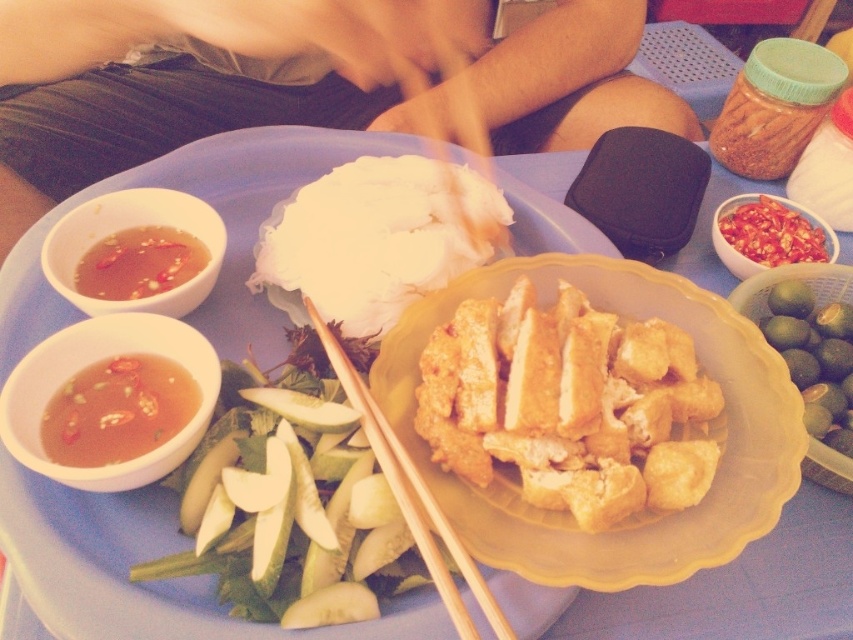
Does skinny jeans at upper left lie behind golden crispy chicken at center?

Yes, skinny jeans at upper left is further from the viewer.

Identify the location of skinny jeans at upper left. (143, 100).

The width and height of the screenshot is (853, 640). What do you see at coordinates (143, 100) in the screenshot?
I see `skinny jeans at upper left` at bounding box center [143, 100].

You are a GUI agent. You are given a task and a screenshot of the screen. Output one action in this format:
    pyautogui.click(x=<x>, y=<y>)
    Task: Click on the skinny jeans at upper left
    
    Given the screenshot: What is the action you would take?
    pyautogui.click(x=143, y=100)

Measure the distance between golden crispy chicken at center and white fluffy rice at center.

golden crispy chicken at center is 5.30 inches from white fluffy rice at center.

Can you confirm if golden crispy chicken at center is smaller than white fluffy rice at center?

Yes, golden crispy chicken at center is smaller than white fluffy rice at center.

Where is `golden crispy chicken at center`? The width and height of the screenshot is (853, 640). golden crispy chicken at center is located at coordinates (567, 404).

Find the location of a particular element. golden crispy chicken at center is located at coordinates (567, 404).

Who is lower down, yellow plastic plate at center or green matte bowl at lower right?

green matte bowl at lower right is below.

Does point (546, 612) lie behind point (759, 298)?

No, it is not.

Who is more distant from viewer, (136,506) or (848,480)?

The point (848,480) is behind.

Where is `yellow plastic plate at center`? This screenshot has width=853, height=640. yellow plastic plate at center is located at coordinates (138, 561).